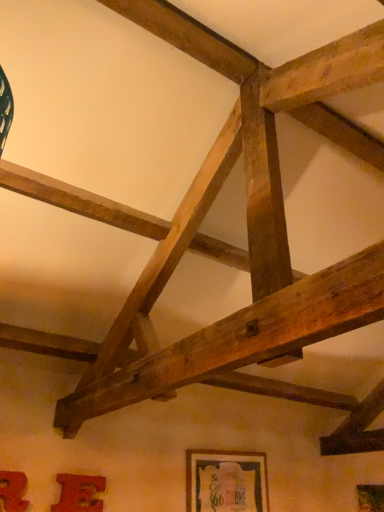
Describe the element at coordinates (79, 493) in the screenshot. This screenshot has height=512, width=384. I see `matte red picture frame at lower left, the second picture frame viewed from the front` at that location.

Identify the location of matte red picture frame at lower left, which appears as the third picture frame when viewed from the back. This screenshot has width=384, height=512. (13, 490).

Locate an element on the screen. The width and height of the screenshot is (384, 512). wooden framed poster at lower center, the 1th picture frame viewed from the right is located at coordinates (226, 482).

Can you confirm if matte red picture frame at lower left, which is the 1th picture frame in left-to-right order, is smaller than matte red picture frame at lower left, acting as the 2th picture frame starting from the right?

No.

Is matte red picture frame at lower left, acting as the third picture frame starting from the right, positioned beyond the bounds of matte red picture frame at lower left, the 2th picture frame from the left?

matte red picture frame at lower left, acting as the third picture frame starting from the right, is positioned outside matte red picture frame at lower left, the 2th picture frame from the left.

Where is `the 1st picture frame positioned above the matte red picture frame at lower left, the second picture frame viewed from the front (from a real-world perspective)`? This screenshot has width=384, height=512. the 1st picture frame positioned above the matte red picture frame at lower left, the second picture frame viewed from the front (from a real-world perspective) is located at coordinates (13, 490).

Who is taller, matte red picture frame at lower left, which appears as the third picture frame when viewed from the back, or wooden framed poster at lower center, the 1th picture frame viewed from the right?

wooden framed poster at lower center, the 1th picture frame viewed from the right, is taller.

Can you confirm if matte red picture frame at lower left, which is the 1th picture frame in left-to-right order, is positioned to the left of wooden framed poster at lower center, which is the third picture frame in left-to-right order?

Yes, matte red picture frame at lower left, which is the 1th picture frame in left-to-right order, is to the left of wooden framed poster at lower center, which is the third picture frame in left-to-right order.

Where is `picture frame above the matte red picture frame at lower left, which is the 1th picture frame in left-to-right order (from a real-world perspective)`? The image size is (384, 512). picture frame above the matte red picture frame at lower left, which is the 1th picture frame in left-to-right order (from a real-world perspective) is located at coordinates (226, 482).

Is matte red picture frame at lower left, the second picture frame viewed from the front, oriented away from matte red picture frame at lower left, which is the first picture frame in front-to-back order?

No.

Considering the relative sizes of matte red picture frame at lower left, the second picture frame viewed from the front, and matte red picture frame at lower left, which is the first picture frame in front-to-back order, in the image provided, is matte red picture frame at lower left, the second picture frame viewed from the front, wider than matte red picture frame at lower left, which is the first picture frame in front-to-back order,?

Correct, the width of matte red picture frame at lower left, the second picture frame viewed from the front, exceeds that of matte red picture frame at lower left, which is the first picture frame in front-to-back order.

Find the location of `the 1st picture frame to the right when counting from the matte red picture frame at lower left, which is the 1th picture frame in left-to-right order`. the 1st picture frame to the right when counting from the matte red picture frame at lower left, which is the 1th picture frame in left-to-right order is located at coordinates 79,493.

From a real-world perspective, which is physically above, matte red picture frame at lower left, the second picture frame viewed from the front, or matte red picture frame at lower left, which is the first picture frame in front-to-back order?

matte red picture frame at lower left, which is the first picture frame in front-to-back order, is physically above.

Is matte red picture frame at lower left, which is counted as the second picture frame, starting from the back, facing towards wooden framed poster at lower center, positioned as the 1th picture frame in back-to-front order?

No.

From a real-world perspective, between matte red picture frame at lower left, the second picture frame viewed from the front, and wooden framed poster at lower center, the 1th picture frame viewed from the right, who is vertically lower?

In real-world perspective, matte red picture frame at lower left, the second picture frame viewed from the front, is lower.

From the picture: Who is smaller, matte red picture frame at lower left, the second picture frame viewed from the front, or wooden framed poster at lower center, which is counted as the 3th picture frame, starting from the front?

With smaller size is matte red picture frame at lower left, the second picture frame viewed from the front.

Can you confirm if matte red picture frame at lower left, the second picture frame viewed from the front, is positioned to the right of wooden framed poster at lower center, which is counted as the 3th picture frame, starting from the front?

Incorrect, matte red picture frame at lower left, the second picture frame viewed from the front, is not on the right side of wooden framed poster at lower center, which is counted as the 3th picture frame, starting from the front.

Are wooden framed poster at lower center, which is the third picture frame in left-to-right order, and matte red picture frame at lower left, which is the 1th picture frame in left-to-right order, making contact?

There is a gap between wooden framed poster at lower center, which is the third picture frame in left-to-right order, and matte red picture frame at lower left, which is the 1th picture frame in left-to-right order.

From a real-world perspective, does wooden framed poster at lower center, which is the third picture frame in left-to-right order, stand above matte red picture frame at lower left, which appears as the third picture frame when viewed from the back?

Correct, in the physical world, wooden framed poster at lower center, which is the third picture frame in left-to-right order, is higher than matte red picture frame at lower left, which appears as the third picture frame when viewed from the back.

From the image's perspective, starting from the wooden framed poster at lower center, positioned as the 1th picture frame in back-to-front order, which picture frame is the 2nd one above? Please provide its 2D coordinates.

[(13, 490)]

From the image's perspective, is wooden framed poster at lower center, which is the third picture frame in left-to-right order, positioned above or below matte red picture frame at lower left, acting as the third picture frame starting from the right?

Based on their image positions, wooden framed poster at lower center, which is the third picture frame in left-to-right order, is located beneath matte red picture frame at lower left, acting as the third picture frame starting from the right.

Could you tell me if wooden framed poster at lower center, which is counted as the 3th picture frame, starting from the front, is facing matte red picture frame at lower left, which is counted as the second picture frame, starting from the back?

No, wooden framed poster at lower center, which is counted as the 3th picture frame, starting from the front, is not turned towards matte red picture frame at lower left, which is counted as the second picture frame, starting from the back.

How distant is wooden framed poster at lower center, which is the third picture frame in left-to-right order, from matte red picture frame at lower left, which is counted as the second picture frame, starting from the back?

wooden framed poster at lower center, which is the third picture frame in left-to-right order, is 98.03 centimeters from matte red picture frame at lower left, which is counted as the second picture frame, starting from the back.

Between wooden framed poster at lower center, which is the third picture frame in left-to-right order, and matte red picture frame at lower left, the second picture frame viewed from the front, which one appears on the right side from the viewer's perspective?

wooden framed poster at lower center, which is the third picture frame in left-to-right order.

Considering the relative sizes of wooden framed poster at lower center, positioned as the 1th picture frame in back-to-front order, and matte red picture frame at lower left, which is counted as the second picture frame, starting from the back, in the image provided, is wooden framed poster at lower center, positioned as the 1th picture frame in back-to-front order, bigger than matte red picture frame at lower left, which is counted as the second picture frame, starting from the back,?

Correct, wooden framed poster at lower center, positioned as the 1th picture frame in back-to-front order, is larger in size than matte red picture frame at lower left, which is counted as the second picture frame, starting from the back.

Locate an element on the screen. Image resolution: width=384 pixels, height=512 pixels. picture frame on the left of matte red picture frame at lower left, which is counted as the second picture frame, starting from the back is located at coordinates (13, 490).

Find the location of `the 1st picture frame positioned below the wooden framed poster at lower center, positioned as the 1th picture frame in back-to-front order (from a real-world perspective)`. the 1st picture frame positioned below the wooden framed poster at lower center, positioned as the 1th picture frame in back-to-front order (from a real-world perspective) is located at coordinates (13, 490).

Estimate the real-world distances between objects in this image. Which object is closer to matte red picture frame at lower left, the 2th picture frame from the left, matte red picture frame at lower left, which appears as the third picture frame when viewed from the back, or wooden framed poster at lower center, which is counted as the 3th picture frame, starting from the front?

matte red picture frame at lower left, which appears as the third picture frame when viewed from the back, is closer to matte red picture frame at lower left, the 2th picture frame from the left.

Estimate the real-world distances between objects in this image. Which object is closer to wooden framed poster at lower center, positioned as the 1th picture frame in back-to-front order, matte red picture frame at lower left, which is the 1th picture frame in left-to-right order, or matte red picture frame at lower left, which is counted as the second picture frame, starting from the back?

matte red picture frame at lower left, which is counted as the second picture frame, starting from the back.

Which object lies further to the anchor point wooden framed poster at lower center, which is the third picture frame in left-to-right order, matte red picture frame at lower left, the 2th picture frame from the left, or matte red picture frame at lower left, which is the first picture frame in front-to-back order?

Among the two, matte red picture frame at lower left, which is the first picture frame in front-to-back order, is located further to wooden framed poster at lower center, which is the third picture frame in left-to-right order.

Estimate the real-world distances between objects in this image. Which object is further from matte red picture frame at lower left, which appears as the third picture frame when viewed from the back, wooden framed poster at lower center, the 1th picture frame viewed from the right, or matte red picture frame at lower left, the 2th picture frame from the left?

wooden framed poster at lower center, the 1th picture frame viewed from the right, is positioned further to the anchor matte red picture frame at lower left, which appears as the third picture frame when viewed from the back.

Considering their positions, is wooden framed poster at lower center, positioned as the 1th picture frame in back-to-front order, positioned further to matte red picture frame at lower left, the second picture frame viewed from the front, than matte red picture frame at lower left, which appears as the third picture frame when viewed from the back?

Among the two, wooden framed poster at lower center, positioned as the 1th picture frame in back-to-front order, is located further to matte red picture frame at lower left, the second picture frame viewed from the front.

Consider the image. When comparing their distances from matte red picture frame at lower left, which is the 1th picture frame in left-to-right order, does matte red picture frame at lower left, the second picture frame viewed from the front, or wooden framed poster at lower center, the 1th picture frame viewed from the right, seem closer?

matte red picture frame at lower left, the second picture frame viewed from the front, is closer to matte red picture frame at lower left, which is the 1th picture frame in left-to-right order.

Where is `picture frame between matte red picture frame at lower left, which is the 1th picture frame in left-to-right order, and wooden framed poster at lower center, which is counted as the 3th picture frame, starting from the front, in the horizontal direction`? The image size is (384, 512). picture frame between matte red picture frame at lower left, which is the 1th picture frame in left-to-right order, and wooden framed poster at lower center, which is counted as the 3th picture frame, starting from the front, in the horizontal direction is located at coordinates (79, 493).